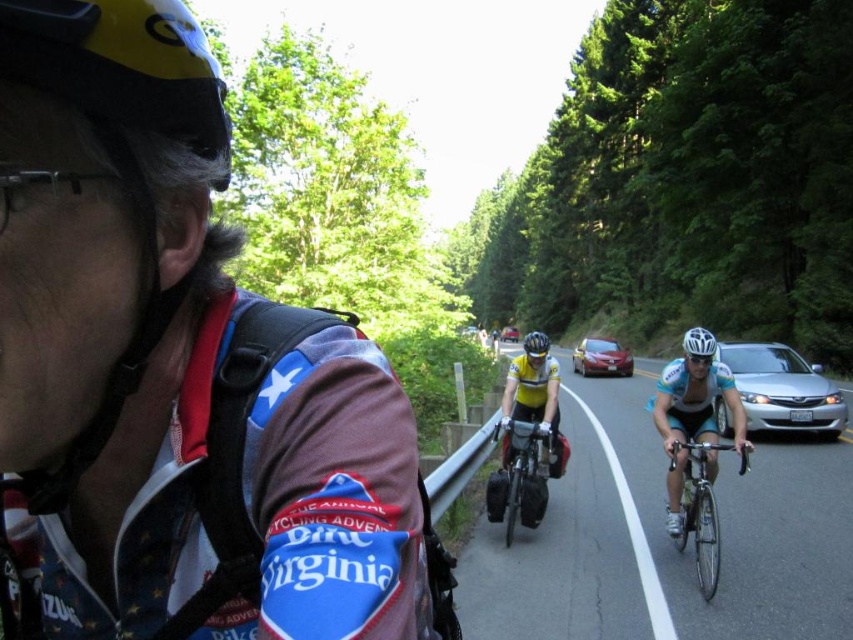
Question: Which of the following is the closest to the observer?

Choices:
 (A) (712, 353)
 (B) (759, 598)

Answer: (B)

Question: Which is farther from the black matte bicycle at center?

Choices:
 (A) yellow matte bicycle helmet at center
 (B) silver metallic sedan at right

Answer: (B)

Question: Among these objects, which one is nearest to the camera?

Choices:
 (A) white matte bicycle helmet at center
 (B) black matte bicycle at center

Answer: (A)

Question: Is silver metallic bicycle at right to the right of black matte bicycle at center from the viewer's perspective?

Choices:
 (A) yes
 (B) no

Answer: (A)

Question: Is metallic silver sedan at center bigger than white matte bicycle helmet at center?

Choices:
 (A) yes
 (B) no

Answer: (B)

Question: Considering the relative positions of black matte bicycle at center and metallic silver sedan at center in the image provided, where is black matte bicycle at center located with respect to metallic silver sedan at center?

Choices:
 (A) below
 (B) above

Answer: (B)